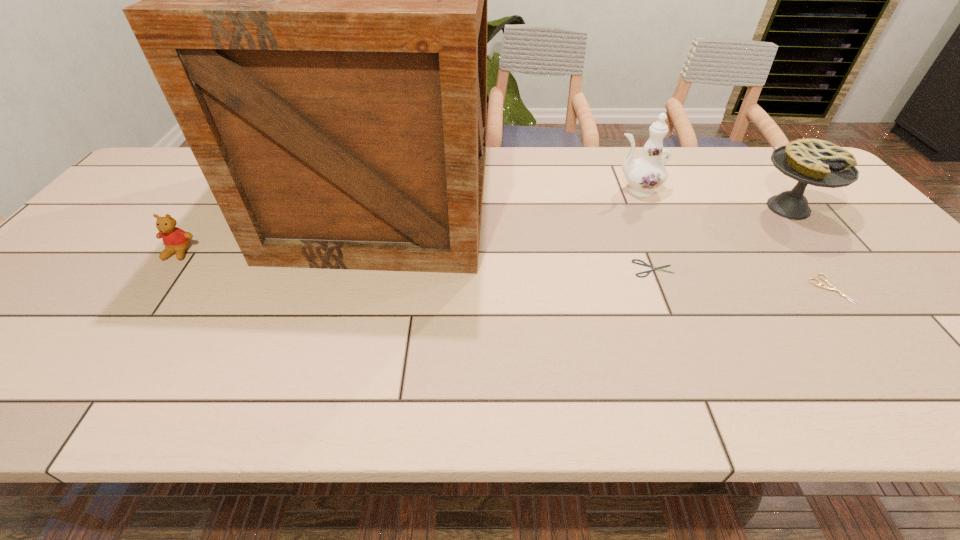
Find the location of a particular element. The width and height of the screenshot is (960, 540). pie present at the far edge is located at coordinates (820, 163).

You are a GUI agent. You are given a task and a screenshot of the screen. Output one action in this format:
    pyautogui.click(x=<x>, y=<y>)
    Task: Click on the object present at the right edge
    
    Given the screenshot: What is the action you would take?
    pyautogui.click(x=820, y=163)

Locate an element on the screen. object that is at the far right corner is located at coordinates (820, 163).

This screenshot has height=540, width=960. In the image, there is a desktop. In order to click on vacant space at the far edge in this screenshot , I will do `click(580, 159)`.

Identify the location of vacant space at the near edge of the desktop. This screenshot has height=540, width=960. tap(65, 395).

Find the location of a particular element. Image resolution: width=960 pixels, height=540 pixels. blank space at the left edge of the desktop is located at coordinates (59, 294).

Locate an element on the screen. The width and height of the screenshot is (960, 540). vacant region at the right edge of the desktop is located at coordinates (831, 237).

Locate an element on the screen. Image resolution: width=960 pixels, height=540 pixels. free spot at the far left corner of the desktop is located at coordinates (167, 165).

The width and height of the screenshot is (960, 540). I want to click on free space between the left shears and the pie, so click(721, 238).

Where is `free space between the tallest object and the shorter shears`? free space between the tallest object and the shorter shears is located at coordinates (519, 235).